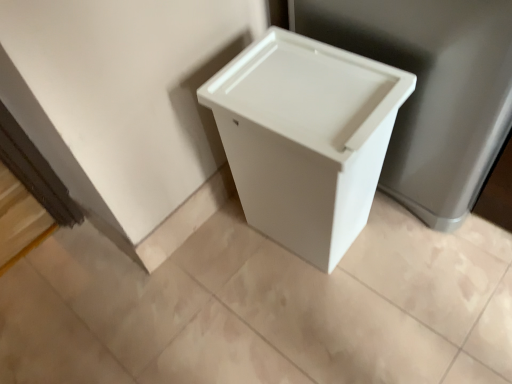
Question: Should I look upward or downward to see white plastic trash can at center?

Choices:
 (A) up
 (B) down

Answer: (A)

Question: Does white plastic trash can at center appear on the right side of white plastic waste container at center?

Choices:
 (A) yes
 (B) no

Answer: (A)

Question: Can you confirm if white plastic trash can at center is thinner than white plastic waste container at center?

Choices:
 (A) yes
 (B) no

Answer: (B)

Question: Can you confirm if white plastic trash can at center is taller than white plastic waste container at center?

Choices:
 (A) yes
 (B) no

Answer: (A)

Question: Is white plastic trash can at center positioned far away from white plastic waste container at center?

Choices:
 (A) yes
 (B) no

Answer: (B)

Question: From the image's perspective, does white plastic trash can at center appear lower than white plastic waste container at center?

Choices:
 (A) no
 (B) yes

Answer: (A)

Question: Are white plastic trash can at center and white plastic waste container at center making contact?

Choices:
 (A) no
 (B) yes

Answer: (A)

Question: Is white plastic waste container at center in contact with white plastic trash can at center?

Choices:
 (A) no
 (B) yes

Answer: (A)

Question: Could you tell me if white plastic waste container at center is turned towards white plastic trash can at center?

Choices:
 (A) no
 (B) yes

Answer: (A)

Question: Can you confirm if white plastic waste container at center is thinner than white plastic trash can at center?

Choices:
 (A) yes
 (B) no

Answer: (A)

Question: Is the position of white plastic waste container at center less distant than that of white plastic trash can at center?

Choices:
 (A) no
 (B) yes

Answer: (A)

Question: Does white plastic waste container at center appear on the right side of white plastic trash can at center?

Choices:
 (A) no
 (B) yes

Answer: (A)

Question: Considering the relative sizes of white plastic waste container at center and white plastic trash can at center in the image provided, is white plastic waste container at center shorter than white plastic trash can at center?

Choices:
 (A) no
 (B) yes

Answer: (B)

Question: In terms of height, does white plastic trash can at center look taller or shorter compared to white plastic waste container at center?

Choices:
 (A) short
 (B) tall

Answer: (B)